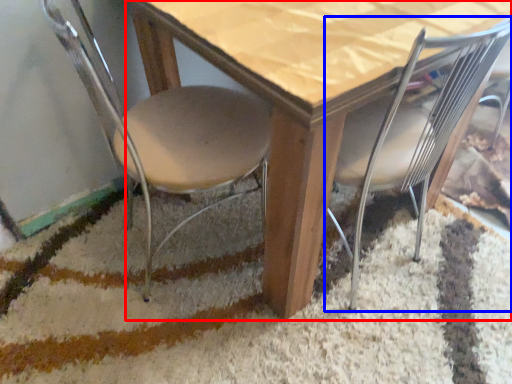
Question: Among these objects, which one is farthest to the camera, table (highlighted by a red box) or chair (highlighted by a blue box)?

Choices:
 (A) table
 (B) chair

Answer: (B)